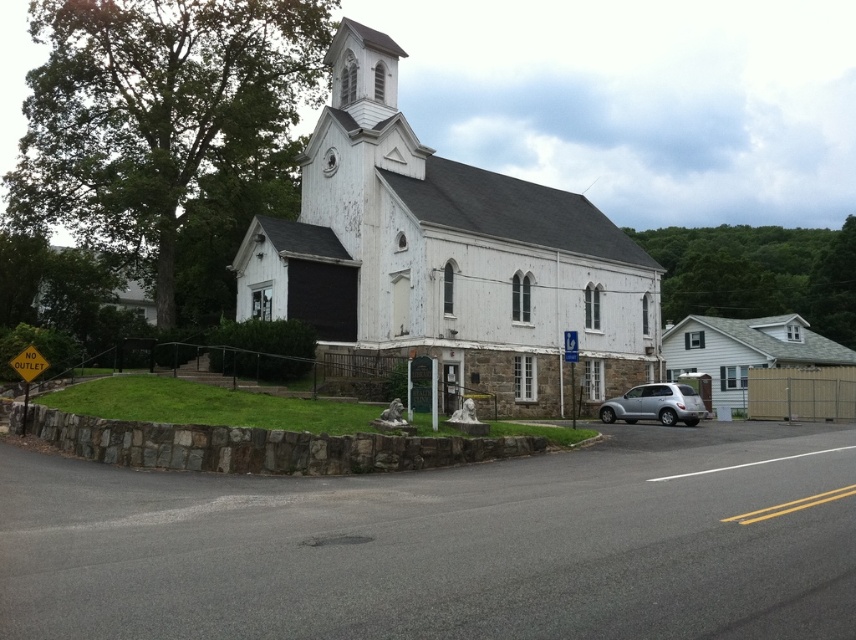
You are standing at the entrance of the white wooden church at center. If you walk straight ahead, which direction will you be facing relative to the church?

Since the white wooden church at center is positioned with its entrance facing forward, walking straight ahead from the entrance would mean facing away from the church towards the grassy area and stone wall in front of it.

You are a photographer planning to capture a wide shot of the white wooden church at center and the silver metallic suv at lower right. Given that the church is wider than the SUV, how should you position your camera to ensure both are fully in frame?

Since the white wooden church at center is wider than the silver metallic suv at lower right, position the camera closer to the church to accommodate its greater width while keeping the suv at lower right within the frame.